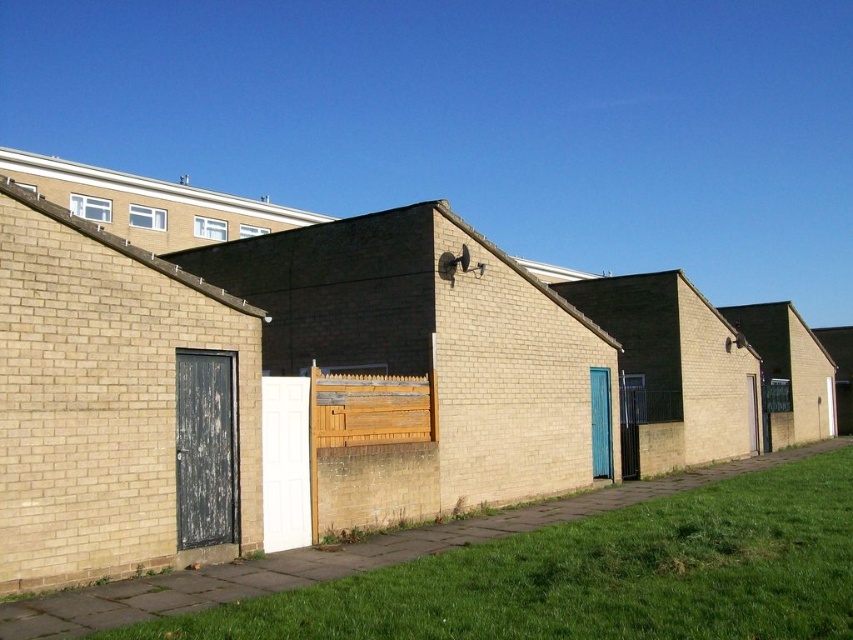
You are a gardener planning to mow the green grass at lower right and trim the weathered wood fence at center. Based on their widths, which area requires more time to maintain?

The green grass at lower right might be wider than the weathered wood fence at center, so it likely requires more time to maintain.

You are standing on the paved pathway and want to walk towards the buildings. Which object, the green grass at lower right or the weathered wood fence at center, will you encounter first?

The green grass at lower right is closer to the viewer than the weathered wood fence at center, so you will encounter the green grass at lower right first.